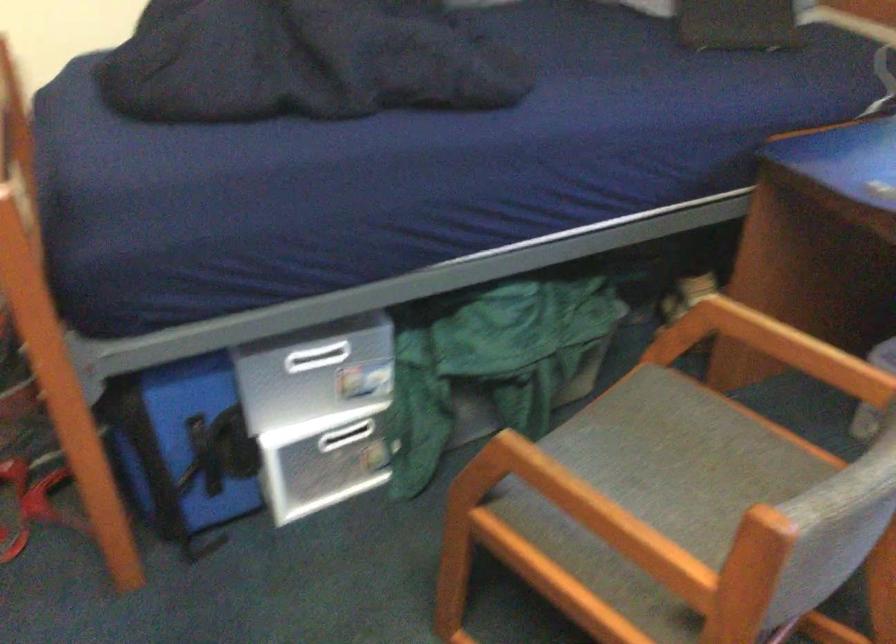
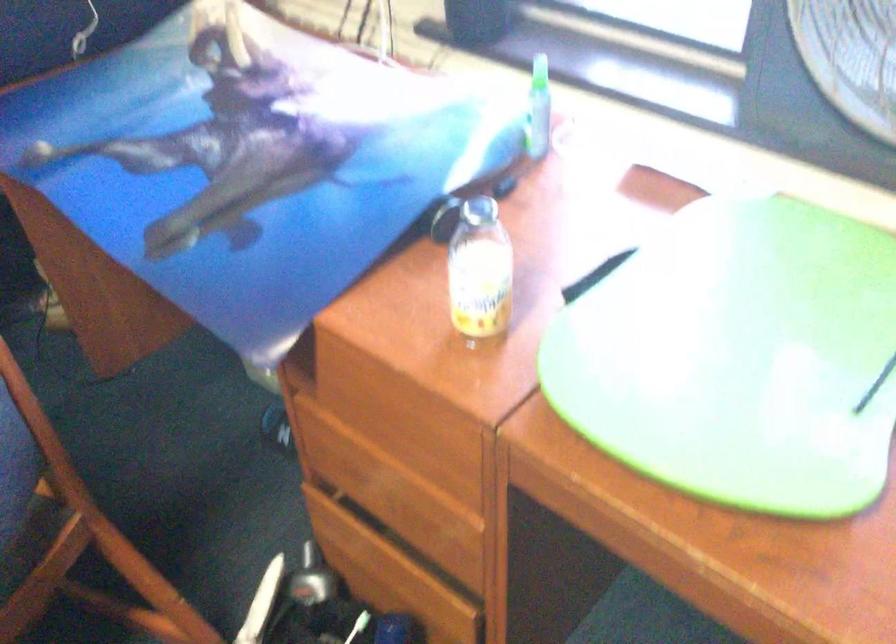
Question: The first image is from the beginning of the video and the second image is from the end. How did the camera likely rotate when shooting the video?

Choices:
 (A) Left
 (B) Right
 (C) Up
 (D) Down

Answer: (B)